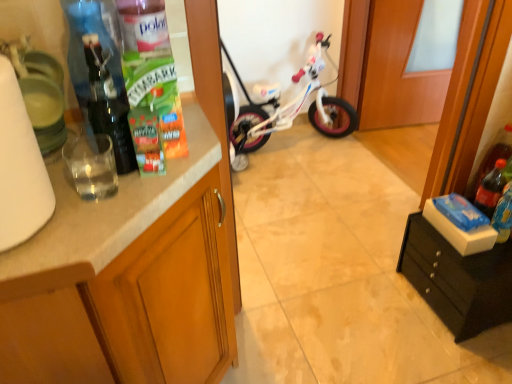
Question: From their relative heights in the image, would you say white matte paper towel at left is taller or shorter than matte wood cabinet at left, the second cabinetry in the right-to-left sequence?

Choices:
 (A) short
 (B) tall

Answer: (A)

Question: Is white matte paper towel at left bigger or smaller than matte wood cabinet at left, the second cabinetry in the right-to-left sequence?

Choices:
 (A) big
 (B) small

Answer: (B)

Question: Estimate the real-world distances between objects in this image. Which object is closer to the white marble countertop at left?

Choices:
 (A) matte wood cabinet at left, the second cabinetry in the right-to-left sequence
 (B) translucent plastic soda bottle at right, marked as the 2th bottle in a front-to-back arrangement
 (C) wooden door at center
 (D) clear plastic bottle at upper left, positioned as the 1th bottle in front-to-back order
 (E) translucent plastic soda bottle at right, marked as the first bottle in a right-to-left arrangement

Answer: (A)

Question: Considering the real-world distances, which object is farthest from the blue cardboard box at right?

Choices:
 (A) black matte drawer at lower right, the first cabinetry from the right
 (B) white glossy bicycle at center
 (C) wooden door at center
 (D) clear plastic bottle at upper left, positioned as the 1th bottle in front-to-back order
 (E) translucent plastic soda bottle at right, arranged as the 2th bottle when viewed from the left

Answer: (C)